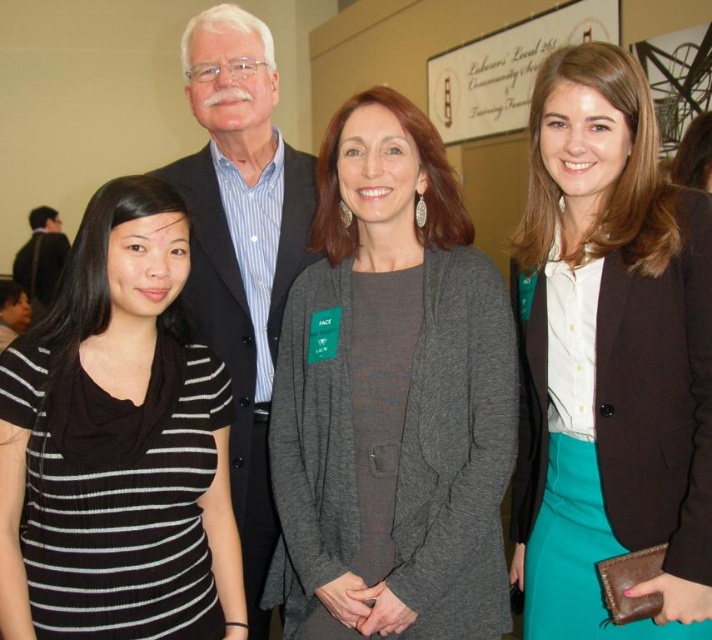
You are a photographer adjusting the camera settings for a group photo. You notice the teal satin skirt at center and the matte black suit at left. Which object is closer to the camera?

The teal satin skirt at center is closer to the camera because it is in front of the matte black suit at left.

You are attending an event and see the matte black suit at center and the wooden sign at upper center. Based on their positions, which object is closer to the left side of the image?

The matte black suit at center is closer to the left side of the image because it is positioned to the left of the wooden sign at upper center.

You are a photographer adjusting your camera settings. You notice the matte black suit at center and the wooden sign at upper center in your viewfinder. Which object is positioned closer to your camera lens?

The matte black suit at center is closer to the viewer than the wooden sign at upper center, so the matte black suit at center is positioned closer to your camera lens.